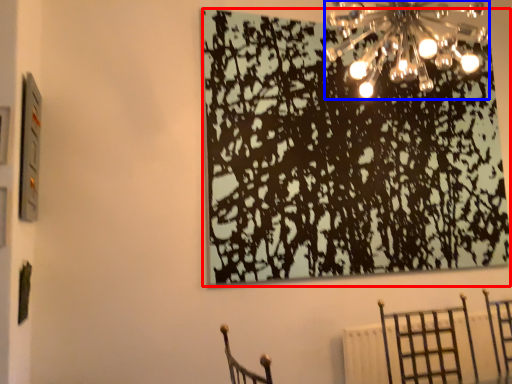
Question: Among these objects, which one is farthest to the camera, tree (highlighted by a red box) or lamp (highlighted by a blue box)?

Choices:
 (A) tree
 (B) lamp

Answer: (A)